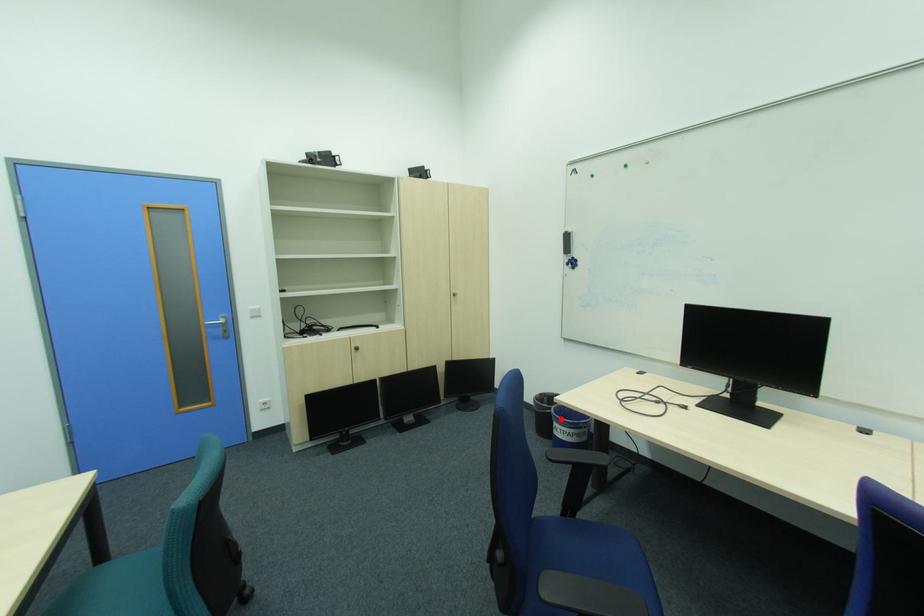
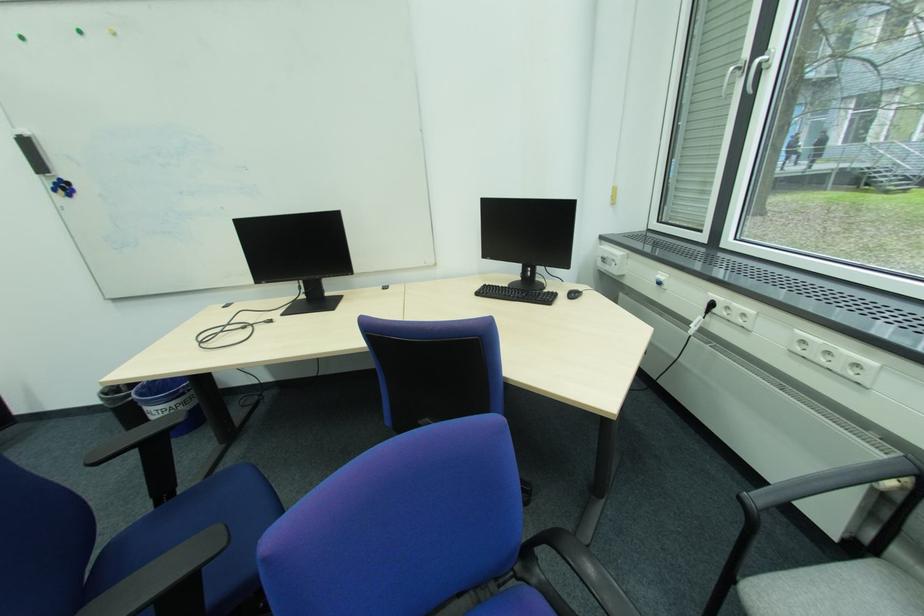
The point at the highlighted location is marked in the first image. Where is the corresponding point in the second image?

(149, 403)